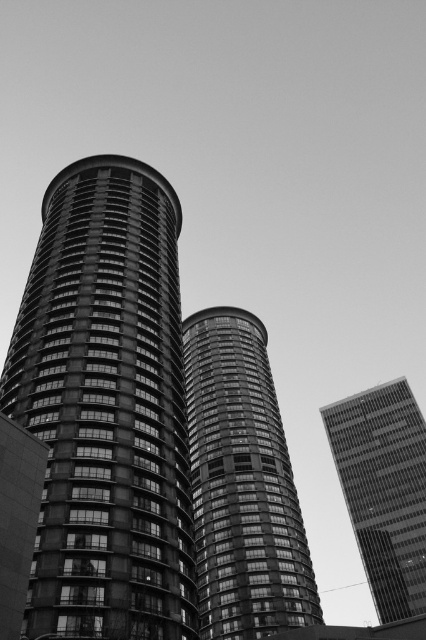
You are standing at point (106, 408) in the image. Based on the scene description, what structure are you directly facing?

You are directly facing the concrete tower at center located at point (106, 408).

You are standing in front of the two smooth glass structures in the image. Which one, the smooth glass tower at center or the smooth glass windows at center, is closer to you?

The smooth glass tower at center is closer to you than the smooth glass windows at center.

You are standing in front of two central structures in the image. The concrete tower at center and the smooth glass windows at center. Which one is positioned to the left?

The concrete tower at center is to the left of smooth glass windows at center.